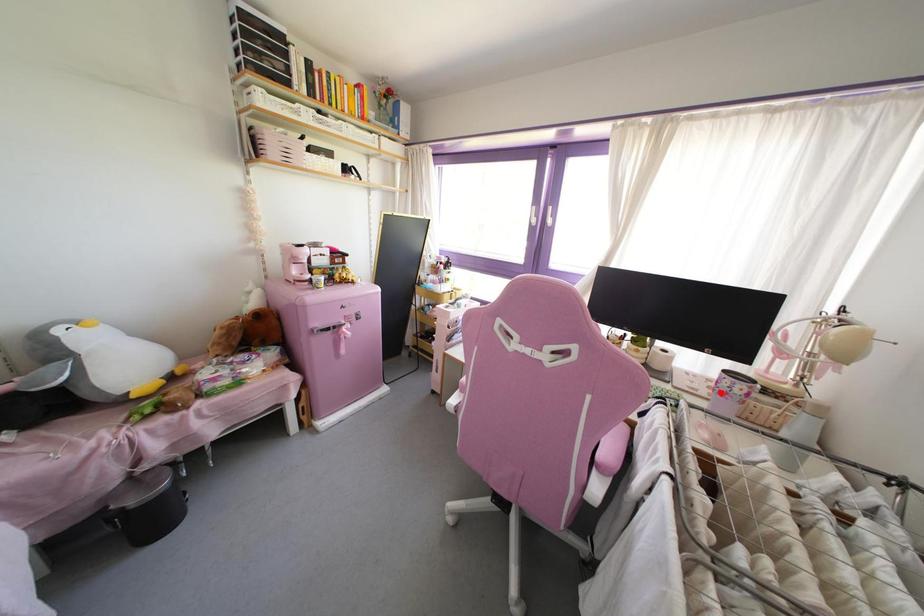
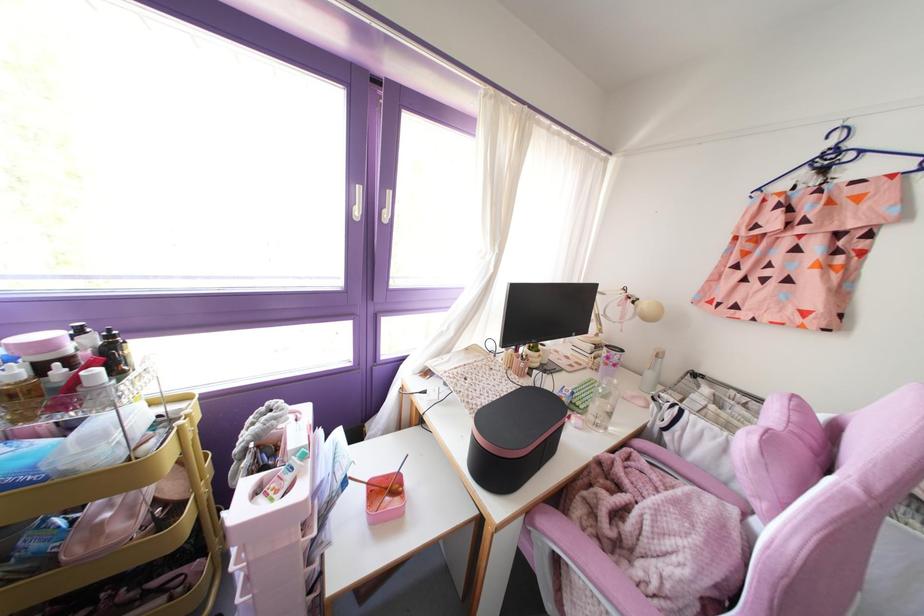
Find the pixel in the second image that matches the highlighted location in the first image.

(614, 365)